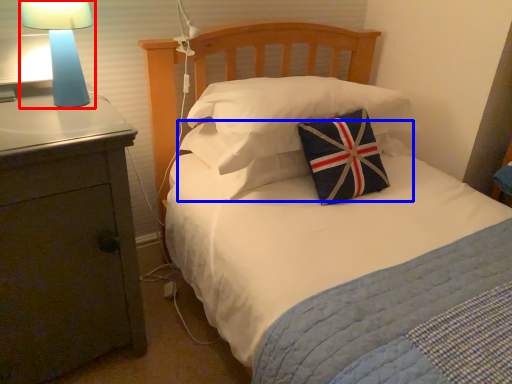
Question: Which of the following is the closest to the observer, lamp (highlighted by a red box) or pillow (highlighted by a blue box)?

Choices:
 (A) lamp
 (B) pillow

Answer: (A)